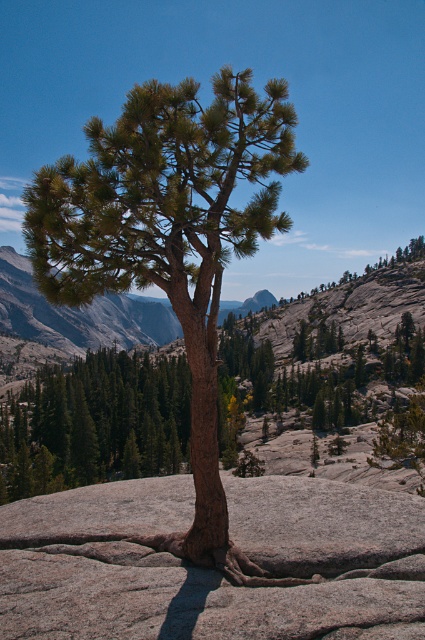
You are standing at the base of the pine tree and want to reach the point marked as point [11,579]. However, there is an obstacle at point [229,248]. Will you encounter the obstacle before reaching your destination?

Since point [11,579] is in front of point [229,248], you will reach the destination before encountering the obstacle.

You are a hiker who wants to place a water bottle on the gray rough boulder at center and the brown rough bark tree at center. Which object allows you to place the water bottle more to the right?

The gray rough boulder at center is to the right of the brown rough bark tree at center, so placing the water bottle on the gray rough boulder at center would position it more to the right.

You are a hiker who wants to place a 4 meter long tent between the gray rough boulder at center and the brown rough bark tree at center. Can you fit the tent between them without overlapping either object?

The distance between the gray rough boulder at center and the brown rough bark tree at center is 3.93 meters. Since the tent is 4 meters long, it cannot fit between them without overlapping one of the objects.